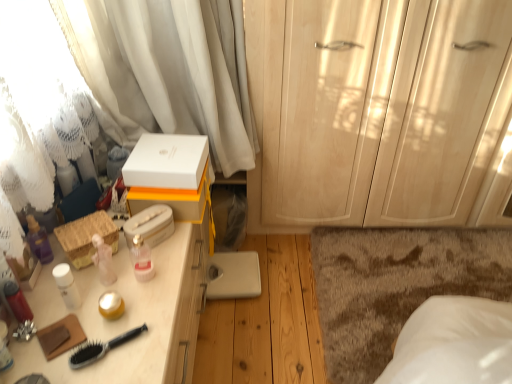
Locate an element on the screen. free space between black plastic brush at lower left and matte white lotion at left, placed as the 1th toiletry when sorted from left to right is located at coordinates (52, 355).